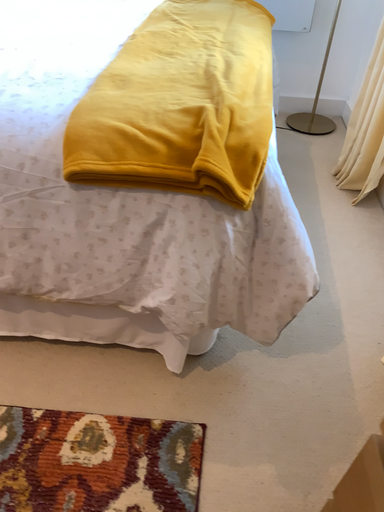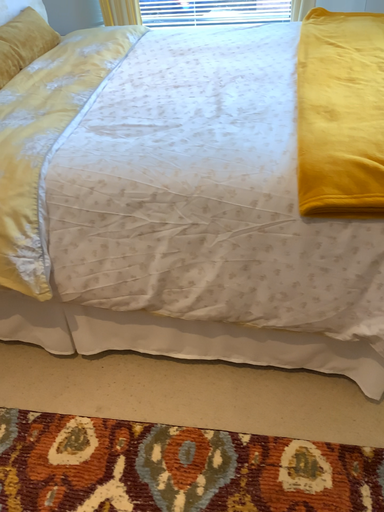
Question: Which way did the camera rotate in the video?

Choices:
 (A) rotated right
 (B) rotated left

Answer: (B)